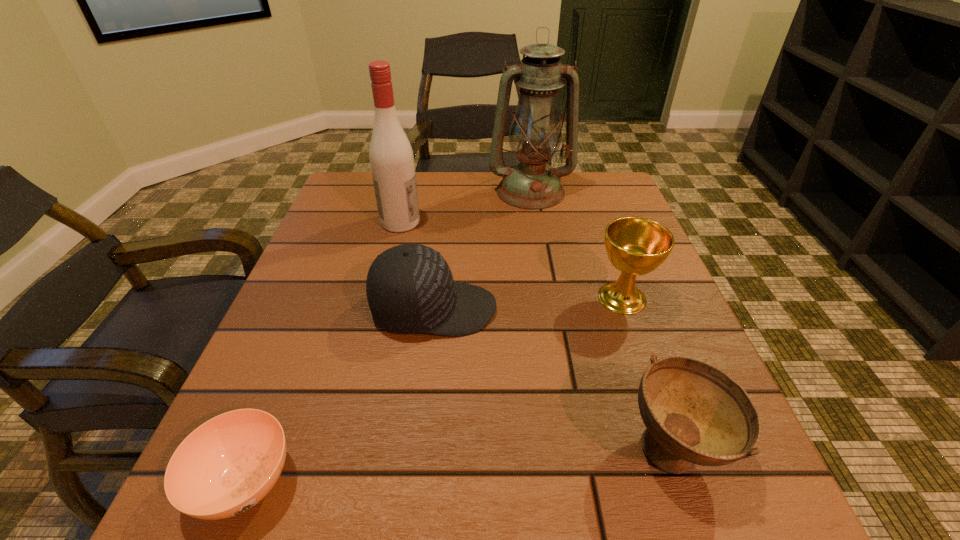
Find the location of a particular element. This screenshot has width=960, height=540. free space at the near right corner of the desktop is located at coordinates (765, 514).

Identify the location of vacant area between the shortest object and the baseball cap. (339, 395).

Where is `empty space that is in between the taller soup bowl and the alcohol`? This screenshot has height=540, width=960. empty space that is in between the taller soup bowl and the alcohol is located at coordinates (538, 335).

Where is `free spot between the right soup bowl and the second farthest object`? free spot between the right soup bowl and the second farthest object is located at coordinates (538, 335).

This screenshot has width=960, height=540. In order to click on vacant space that is in between the farthest object and the baseball cap in this screenshot , I will do `click(482, 250)`.

Where is `free spot between the leftmost object and the baseball cap`? This screenshot has width=960, height=540. free spot between the leftmost object and the baseball cap is located at coordinates (x=339, y=395).

The image size is (960, 540). What are the coordinates of `free space between the shortest object and the fifth nearest object` in the screenshot? It's located at (323, 352).

Locate an element on the screen. free area in between the baseball cap and the farthest object is located at coordinates [x=482, y=250].

Find the location of a particular element. The width and height of the screenshot is (960, 540). vacant point located between the baseball cap and the farthest object is located at coordinates (482, 250).

The height and width of the screenshot is (540, 960). I want to click on empty space between the chalice and the baseball cap, so click(528, 303).